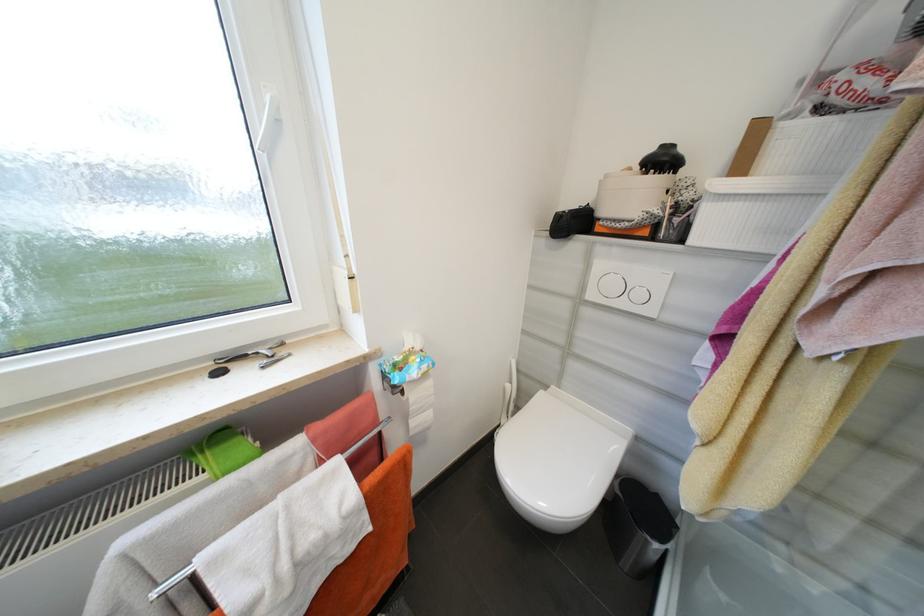
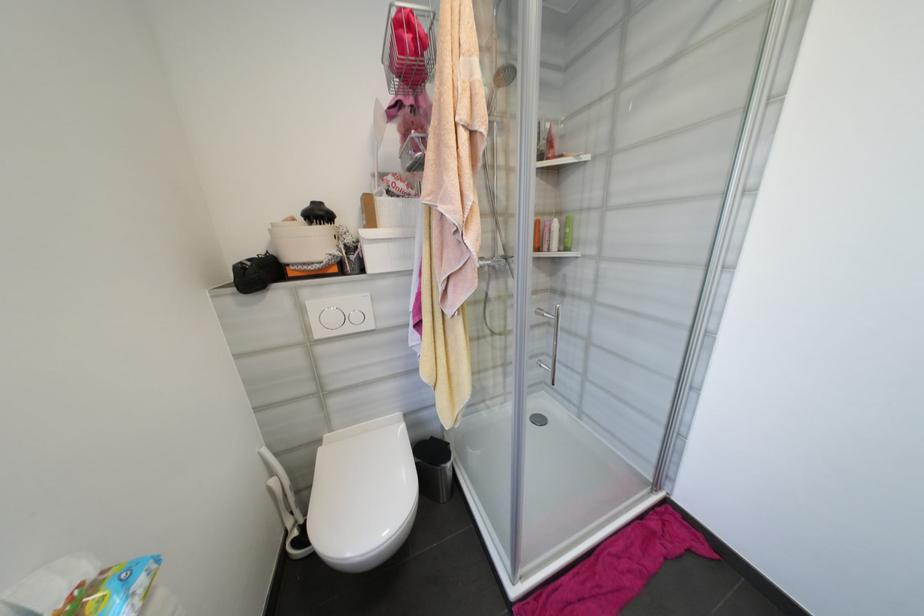
Locate, in the second image, the point that corresponds to point (552, 387) in the first image.

(325, 443)